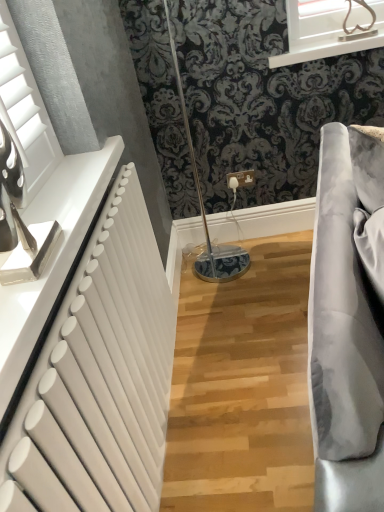
Question: From a real-world perspective, is white matte radiator at left physically below white glossy frame at upper center?

Choices:
 (A) yes
 (B) no

Answer: (A)

Question: Is white matte radiator at left touching white glossy frame at upper center?

Choices:
 (A) no
 (B) yes

Answer: (A)

Question: Does white matte radiator at left appear on the right side of white glossy frame at upper center?

Choices:
 (A) no
 (B) yes

Answer: (A)

Question: Considering the relative sizes of white matte radiator at left and white glossy frame at upper center in the image provided, is white matte radiator at left bigger than white glossy frame at upper center?

Choices:
 (A) no
 (B) yes

Answer: (B)

Question: Is white matte radiator at left completely or partially outside of white glossy frame at upper center?

Choices:
 (A) yes
 (B) no

Answer: (A)

Question: Considering the relative sizes of white matte radiator at left and white glossy frame at upper center in the image provided, is white matte radiator at left smaller than white glossy frame at upper center?

Choices:
 (A) no
 (B) yes

Answer: (A)

Question: Is white glossy frame at upper center shorter than white matte radiator at left?

Choices:
 (A) yes
 (B) no

Answer: (A)

Question: Can you confirm if white glossy frame at upper center is wider than white matte radiator at left?

Choices:
 (A) no
 (B) yes

Answer: (B)

Question: Is the depth of white glossy frame at upper center greater than that of white matte radiator at left?

Choices:
 (A) no
 (B) yes

Answer: (B)

Question: Considering the relative sizes of white glossy frame at upper center and white matte radiator at left in the image provided, is white glossy frame at upper center bigger than white matte radiator at left?

Choices:
 (A) yes
 (B) no

Answer: (B)

Question: Is white matte radiator at left inside white glossy frame at upper center?

Choices:
 (A) no
 (B) yes

Answer: (A)

Question: Is white glossy frame at upper center positioned beyond the bounds of white matte radiator at left?

Choices:
 (A) yes
 (B) no

Answer: (A)

Question: In terms of height, does white matte radiator at left look taller or shorter compared to white glossy frame at upper center?

Choices:
 (A) tall
 (B) short

Answer: (A)